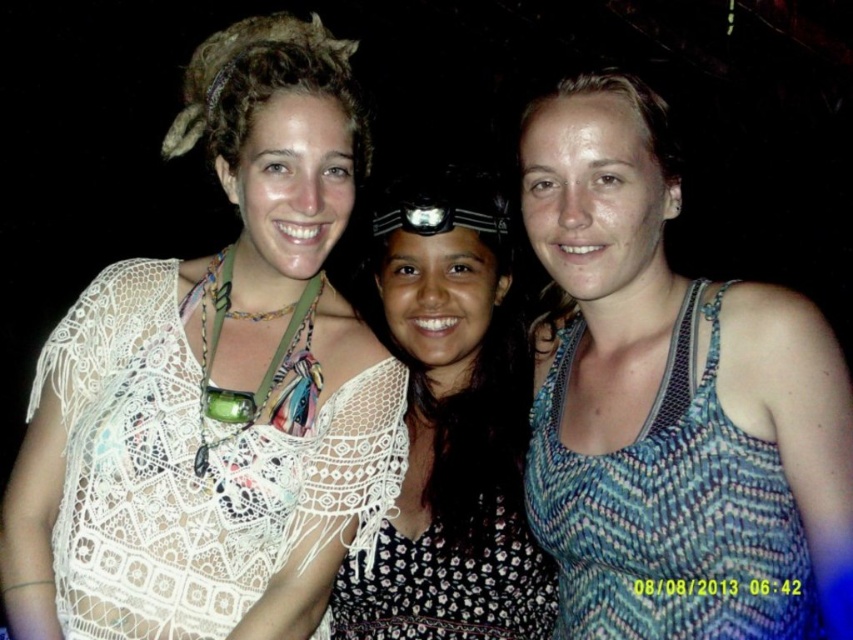
Can you confirm if black lace dress at center is shorter than blue woven tank top at right?

In fact, black lace dress at center may be taller than blue woven tank top at right.

Who is positioned more to the left, black lace dress at center or blue woven tank top at right?

→ black lace dress at center

Where is `black lace dress at center`? black lace dress at center is located at coordinates (450, 428).

Which is in front, point (235, 620) or point (550, 627)?

Point (235, 620)

Is point (115, 396) positioned after point (430, 432)?

No, it is in front of (430, 432).

Is point (33, 452) farther from camera compared to point (368, 586)?

No, (33, 452) is in front of (368, 586).

The height and width of the screenshot is (640, 853). Identify the location of white lace top at upper left. (215, 385).

Who is more forward, (x=288, y=561) or (x=607, y=461)?

Positioned in front is point (x=607, y=461).

Is white lace top at upper left positioned behind blue woven tank top at right?

A: That is True.

Describe the element at coordinates (215, 385) in the screenshot. The image size is (853, 640). I see `white lace top at upper left` at that location.

At what (x,y) coordinates should I click in order to perform the action: click on white lace top at upper left. Please return your answer as a coordinate pair (x, y). This screenshot has width=853, height=640. Looking at the image, I should click on (215, 385).